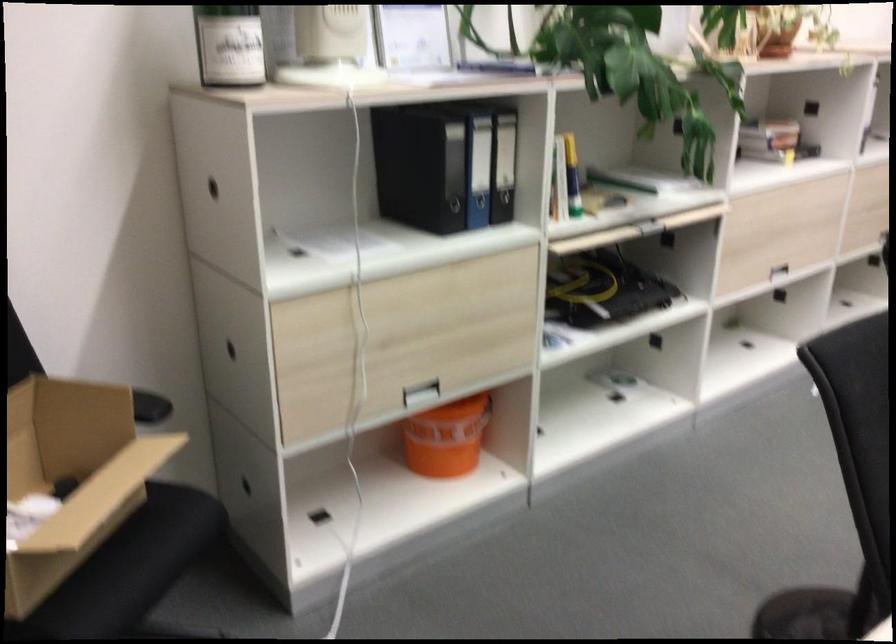
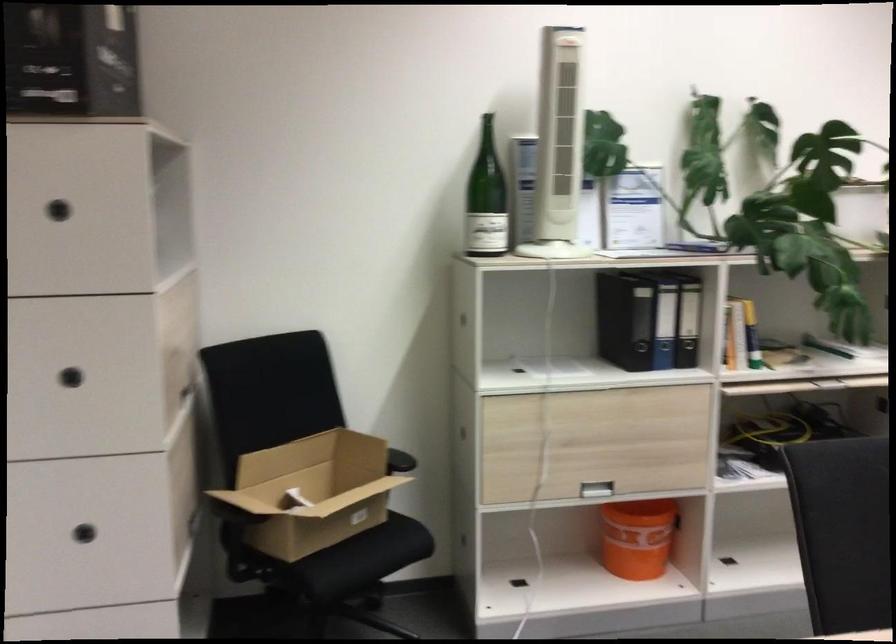
Locate, in the second image, the point that corresponds to the point at 477,174 in the first image.

(664, 325)